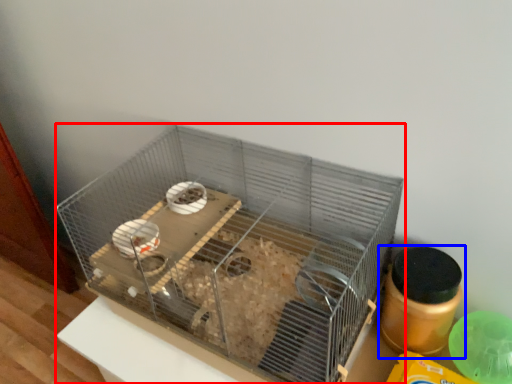
Question: Which object is closer to the camera taking this photo, bird cage (highlighted by a red box) or bottle (highlighted by a blue box)?

Choices:
 (A) bird cage
 (B) bottle

Answer: (A)